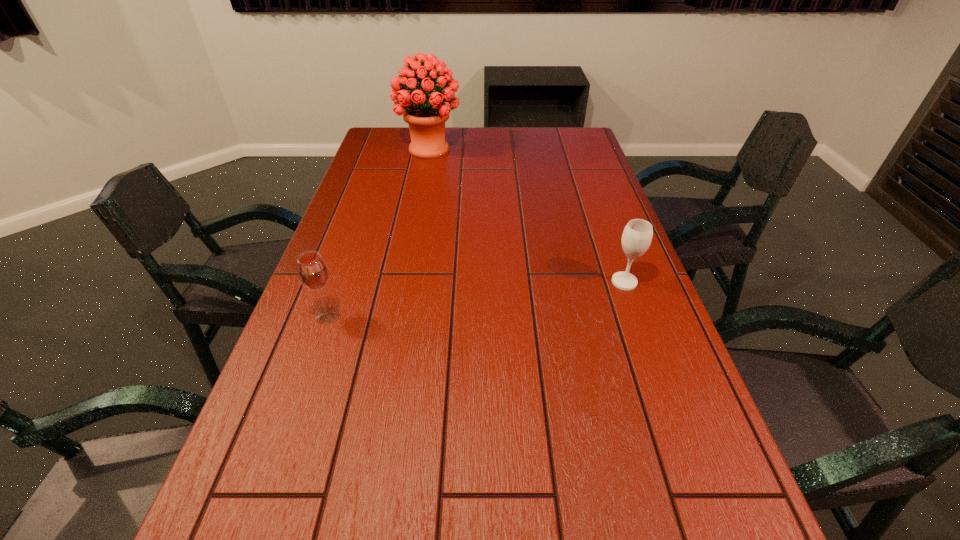
At what (x,y) coordinates should I click in order to perform the action: click on the farthest object. Please return your answer as a coordinate pair (x, y). Looking at the image, I should click on (426, 111).

Where is `the second object from right to left`? The height and width of the screenshot is (540, 960). the second object from right to left is located at coordinates (426, 111).

Locate an element on the screen. The height and width of the screenshot is (540, 960). the leftmost object is located at coordinates (312, 270).

Where is `the nearer wineglass`? the nearer wineglass is located at coordinates [x=312, y=270].

Identify the location of the farther wineglass. The height and width of the screenshot is (540, 960). (637, 235).

Locate an element on the screen. Image resolution: width=960 pixels, height=540 pixels. the rightmost object is located at coordinates (637, 235).

The height and width of the screenshot is (540, 960). In order to click on vacant space located 0.250m on the right of the bouquet in this screenshot , I will do `click(526, 150)`.

Identify the location of vacant point located on the back of the nearest object. The width and height of the screenshot is (960, 540). (343, 273).

Find the location of a particular element. Image resolution: width=960 pixels, height=540 pixels. vacant space located 0.400m on the left of the right wineglass is located at coordinates (458, 282).

Image resolution: width=960 pixels, height=540 pixels. I want to click on object located at the far edge, so click(x=426, y=111).